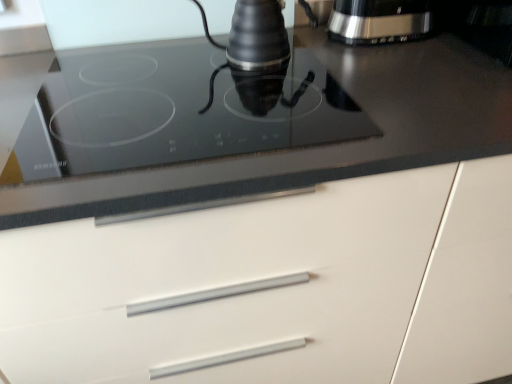
Question: Is satin silver coffee maker at upper right outside of black glass cooktop at upper center?

Choices:
 (A) no
 (B) yes

Answer: (B)

Question: Is the depth of satin silver coffee maker at upper right less than that of black glass cooktop at upper center?

Choices:
 (A) yes
 (B) no

Answer: (B)

Question: From the image's perspective, is satin silver coffee maker at upper right under black glass cooktop at upper center?

Choices:
 (A) no
 (B) yes

Answer: (A)

Question: Is satin silver coffee maker at upper right placed right next to black glass cooktop at upper center?

Choices:
 (A) no
 (B) yes

Answer: (A)

Question: From the image's perspective, is satin silver coffee maker at upper right on top of black glass cooktop at upper center?

Choices:
 (A) no
 (B) yes

Answer: (B)

Question: Is satin silver coffee maker at upper right turned away from black glass cooktop at upper center?

Choices:
 (A) yes
 (B) no

Answer: (B)

Question: From a real-world perspective, is white matte cabinet at center positioned under black glass cooktop at upper center based on gravity?

Choices:
 (A) no
 (B) yes

Answer: (B)

Question: From the image's perspective, is white matte cabinet at center on top of black glass cooktop at upper center?

Choices:
 (A) no
 (B) yes

Answer: (A)

Question: Is there a large distance between white matte cabinet at center and black glass cooktop at upper center?

Choices:
 (A) yes
 (B) no

Answer: (B)

Question: Is white matte cabinet at center beside black glass cooktop at upper center?

Choices:
 (A) yes
 (B) no

Answer: (B)

Question: Is the depth of white matte cabinet at center less than that of black glass cooktop at upper center?

Choices:
 (A) yes
 (B) no

Answer: (A)

Question: Can you confirm if white matte cabinet at center is thinner than black glass cooktop at upper center?

Choices:
 (A) no
 (B) yes

Answer: (A)

Question: Considering the relative sizes of satin silver coffee maker at upper right and white matte cabinet at center in the image provided, is satin silver coffee maker at upper right bigger than white matte cabinet at center?

Choices:
 (A) no
 (B) yes

Answer: (A)